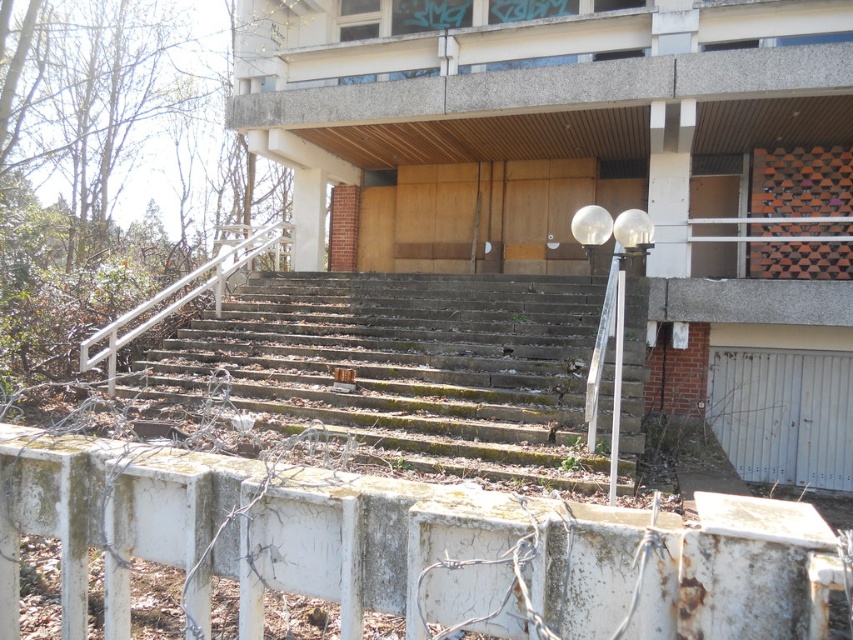
Which is behind, point (244, 317) or point (219, 257)?

Positioned behind is point (244, 317).

Between rusty concrete stairs at center and white metal railing at left, which one has more height?

white metal railing at left is taller.

Which is in front, point (431, 308) or point (236, 252)?

Point (431, 308) is in front.

Identify the location of rusty concrete stairs at center. (407, 368).